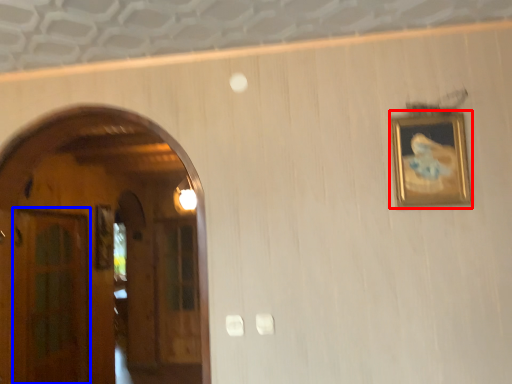
Question: Which object is further to the camera taking this photo, picture frame (highlighted by a red box) or glass door (highlighted by a blue box)?

Choices:
 (A) picture frame
 (B) glass door

Answer: (B)